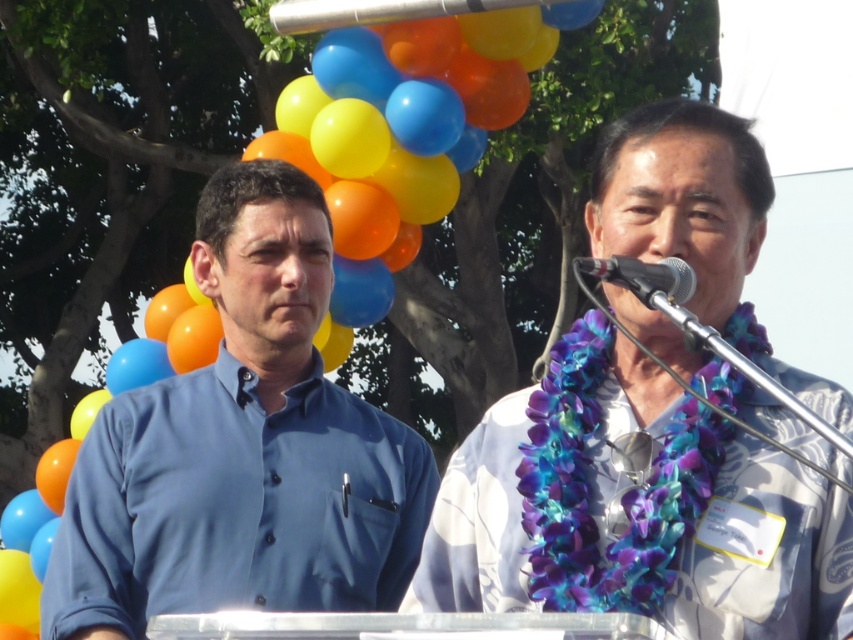
Question: Does blue floral lei at center appear over matte blue shirt at center?

Choices:
 (A) yes
 (B) no

Answer: (B)

Question: Which is farther from the matte blue shirt at center?

Choices:
 (A) blue floral lei at center
 (B) metallic silver microphone at upper center

Answer: (B)

Question: Which point appears closest to the camera in this image?

Choices:
 (A) (643, 289)
 (B) (334, 456)

Answer: (A)

Question: Considering the relative positions of matte blue shirt at center and metallic silver microphone at upper center in the image provided, where is matte blue shirt at center located with respect to metallic silver microphone at upper center?

Choices:
 (A) left
 (B) right

Answer: (A)

Question: Can you confirm if blue floral lei at center is positioned below matte blue shirt at center?

Choices:
 (A) no
 (B) yes

Answer: (B)

Question: Estimate the real-world distances between objects in this image. Which object is farther from the matte blue shirt at center?

Choices:
 (A) metallic silver microphone at upper center
 (B) blue floral lei at center

Answer: (A)